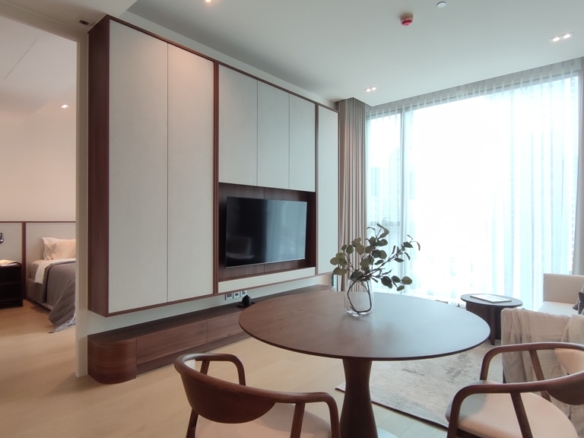
At what (x,y) coordinates should I click in order to perform the action: click on table. Please return your answer as a coordinate pair (x, y). Image resolution: width=584 pixels, height=438 pixels. Looking at the image, I should click on (451, 315).